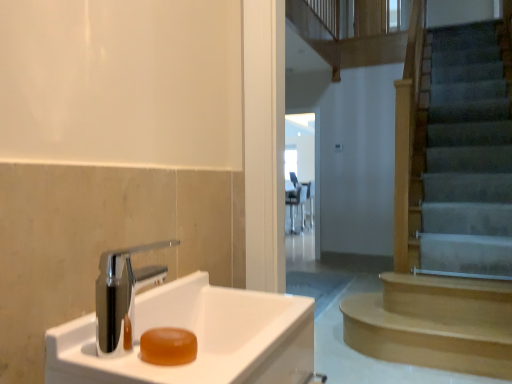
At what (x,y) coordinates should I click in order to perform the action: click on light brown wooden stairs at right. Please return your answer as a coordinate pair (x, y). Looking at the image, I should click on (429, 327).

What do you see at coordinates (197, 338) in the screenshot?
I see `white glossy sink at lower left` at bounding box center [197, 338].

In order to click on transparent glass door at center in this screenshot , I will do `click(307, 160)`.

At what (x,y) coordinates should I click in order to perform the action: click on soap lying in front of the transparent glass door at center. Please return your answer as a coordinate pair (x, y). Looking at the image, I should click on (168, 346).

From the picture: From the image's perspective, is translucent amber soap at sink left on top of transparent glass door at center?

Actually, translucent amber soap at sink left appears below transparent glass door at center in the image.

Does point (165, 340) lie behind point (317, 166)?

That is False.

Are translucent amber soap at sink left and transparent glass door at center far apart?

Yes.

Does translucent amber soap at sink left lie in front of white glossy sink at lower left?

No, translucent amber soap at sink left is further to the viewer.

From the image's perspective, which object appears higher, translucent amber soap at sink left or white glossy sink at lower left?

A: From the image's view, translucent amber soap at sink left is above.

Is translucent amber soap at sink left oriented away from white glossy sink at lower left?

Yes, translucent amber soap at sink left is facing away from white glossy sink at lower left.

Measure the distance between translucent amber soap at sink left and white glossy sink at lower left.

translucent amber soap at sink left is 5.78 inches away from white glossy sink at lower left.

Are transparent glass door at center and light brown wooden stairs at right beside each other?

No, transparent glass door at center is not next to light brown wooden stairs at right.

How far apart are transparent glass door at center and light brown wooden stairs at right?

A distance of 4.13 meters exists between transparent glass door at center and light brown wooden stairs at right.

Which object is closer to the camera taking this photo, transparent glass door at center or light brown wooden stairs at right?

Positioned in front is light brown wooden stairs at right.

Based on the photo, is transparent glass door at center wider than light brown wooden stairs at right?

No.

Is transparent glass door at center not near translucent amber soap at sink left?

transparent glass door at center is far away from translucent amber soap at sink left.

Which of these two, transparent glass door at center or translucent amber soap at sink left, stands taller?

With more height is transparent glass door at center.

From the image's perspective, is transparent glass door at center positioned above or below translucent amber soap at sink left?

transparent glass door at center is situated higher than translucent amber soap at sink left in the image.

How distant is transparent glass door at center from translucent amber soap at sink left?

They are 6.15 meters apart.

From a real-world perspective, who is located higher, white glossy sink at lower left or translucent amber soap at sink left?

translucent amber soap at sink left, from a real-world perspective.

Could you tell me if white glossy sink at lower left is facing translucent amber soap at sink left?

No, white glossy sink at lower left is not turned towards translucent amber soap at sink left.

Considering the positions of points (196, 280) and (152, 350), is point (196, 280) closer to camera compared to point (152, 350)?

No.

How many degrees apart are the facing directions of white glossy sink at lower left and translucent amber soap at sink left?

The facing directions of white glossy sink at lower left and translucent amber soap at sink left are 0.605 degrees apart.

Consider the image. Which of these two, white glossy sink at lower left or transparent glass door at center, is thinner?

transparent glass door at center is thinner.

From a real-world perspective, is white glossy sink at lower left physically located above or below transparent glass door at center?

white glossy sink at lower left is situated lower than transparent glass door at center in the real world.

Does white glossy sink at lower left touch transparent glass door at center?

white glossy sink at lower left and transparent glass door at center are clearly separated.

Does white glossy sink at lower left contain transparent glass door at center?

No, transparent glass door at center is located outside of white glossy sink at lower left.

Is transparent glass door at center taller or shorter than white glossy sink at lower left?

Considering their sizes, transparent glass door at center has more height than white glossy sink at lower left.

Is transparent glass door at center aimed at white glossy sink at lower left?

No, transparent glass door at center does not turn towards white glossy sink at lower left.

Is transparent glass door at center not inside white glossy sink at lower left?

Yes.

Considering the sizes of objects transparent glass door at center and white glossy sink at lower left in the image provided, who is bigger, transparent glass door at center or white glossy sink at lower left?

transparent glass door at center.

At what (x,y) coordinates should I click in order to perform the action: click on soap located underneath the transparent glass door at center (from a real-world perspective). Please return your answer as a coordinate pair (x, y). Looking at the image, I should click on (168, 346).

Where is `soap behind the white glossy sink at lower left`? This screenshot has width=512, height=384. soap behind the white glossy sink at lower left is located at coordinates (168, 346).

Which object lies further to the anchor point light brown wooden stairs at right, white glossy sink at lower left or translucent amber soap at sink left?

translucent amber soap at sink left.

Looking at the image, which one is located further to translucent amber soap at sink left, transparent glass door at center or light brown wooden stairs at right?

transparent glass door at center is further to translucent amber soap at sink left.

Looking at the image, which one is located closer to light brown wooden stairs at right, transparent glass door at center or translucent amber soap at sink left?

translucent amber soap at sink left lies closer to light brown wooden stairs at right than the other object.

Based on their spatial positions, is translucent amber soap at sink left or transparent glass door at center closer to light brown wooden stairs at right?

translucent amber soap at sink left.

Based on their spatial positions, is white glossy sink at lower left or light brown wooden stairs at right closer to translucent amber soap at sink left?

white glossy sink at lower left.

Considering their positions, is transparent glass door at center positioned closer to light brown wooden stairs at right than white glossy sink at lower left?

Among the two, white glossy sink at lower left is located nearer to light brown wooden stairs at right.

Considering their positions, is translucent amber soap at sink left positioned further to transparent glass door at center than white glossy sink at lower left?

translucent amber soap at sink left is further to transparent glass door at center.

Estimate the real-world distances between objects in this image. Which object is further from light brown wooden stairs at right, translucent amber soap at sink left or white glossy sink at lower left?

translucent amber soap at sink left.

Find the location of a particular element. stairs between white glossy sink at lower left and transparent glass door at center along the z-axis is located at coordinates (429, 327).

This screenshot has height=384, width=512. I want to click on soap between white glossy sink at lower left and light brown wooden stairs at right along the z-axis, so click(168, 346).

This screenshot has width=512, height=384. What are the coordinates of `stairs between translucent amber soap at sink left and transparent glass door at center along the z-axis` in the screenshot? It's located at (429, 327).

Identify the location of soap positioned between white glossy sink at lower left and transparent glass door at center from near to far. Image resolution: width=512 pixels, height=384 pixels. (168, 346).